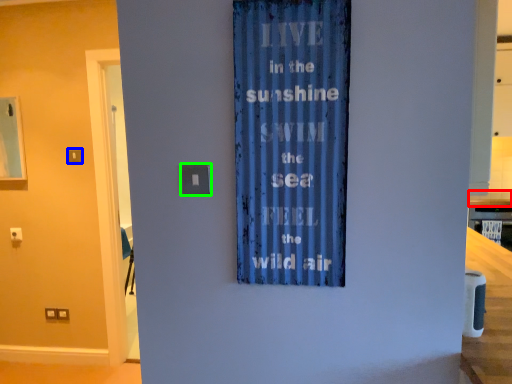
Question: Based on their relative distances, which object is farther from counter top (highlighted by a red box)? Choose from light switch (highlighted by a blue box) and light switch (highlighted by a green box).

Choices:
 (A) light switch
 (B) light switch

Answer: (A)